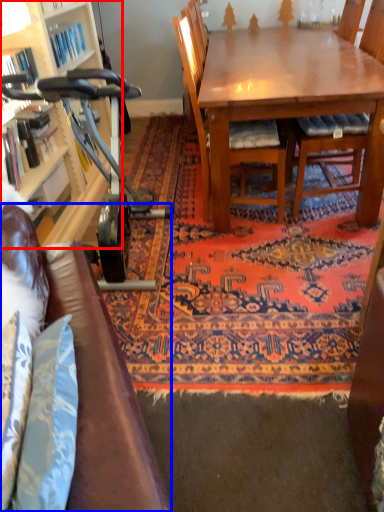
Question: Which object is closer to the camera taking this photo, cabinetry (highlighted by a red box) or studio couch (highlighted by a blue box)?

Choices:
 (A) cabinetry
 (B) studio couch

Answer: (B)